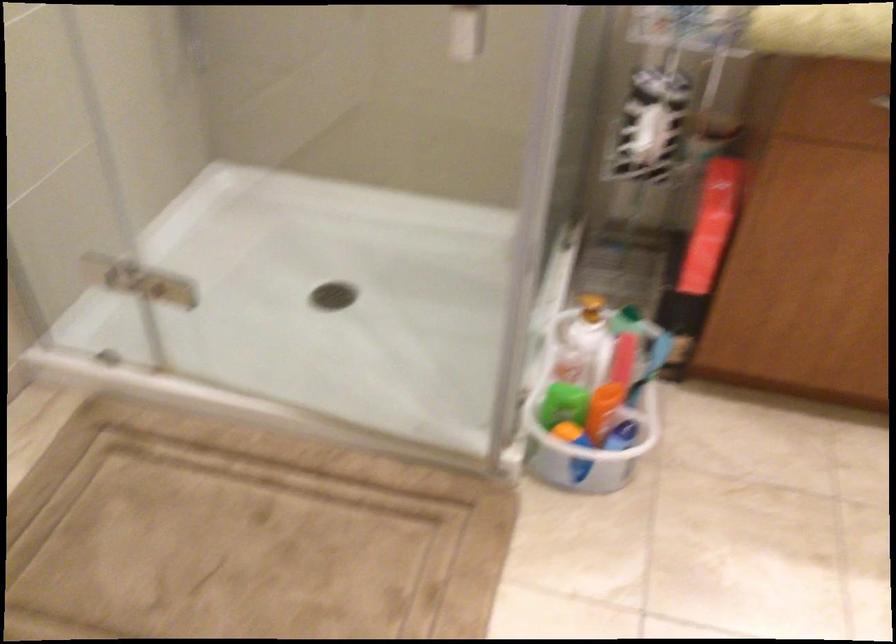
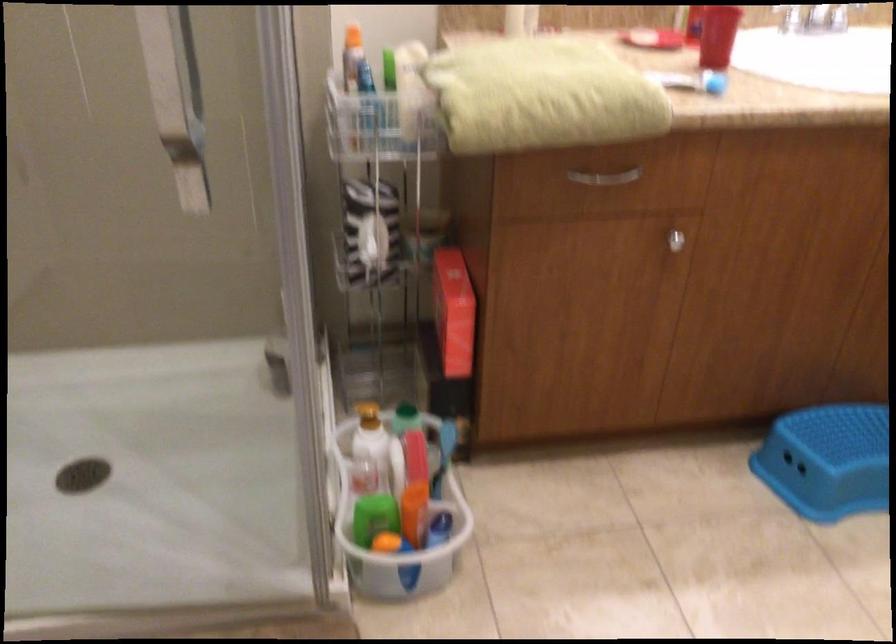
The images are taken continuously from a first-person perspective. In which direction are you moving?

The cameraman moved toward left, forward.